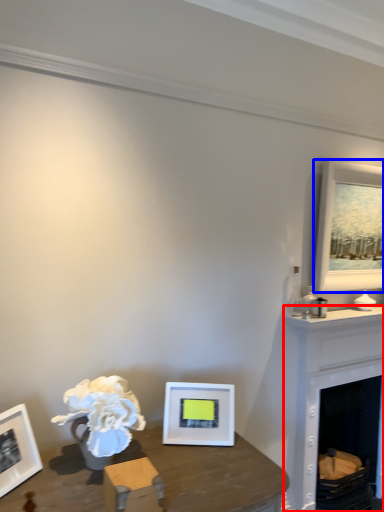
Question: Which object is closer to the camera taking this photo, fireplace (highlighted by a red box) or picture frame (highlighted by a blue box)?

Choices:
 (A) fireplace
 (B) picture frame

Answer: (A)